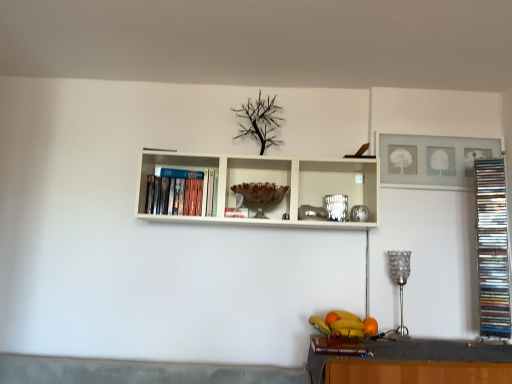
Question: Which direction should I rotate to look at matte brown book at lower center, positioned as the 1th book in front-to-back order, — up or down?

Choices:
 (A) up
 (B) down

Answer: (B)

Question: Is metallic silver stack of cds at right, placed as the third book when sorted from left to right, located outside orange matte at lower right?

Choices:
 (A) no
 (B) yes

Answer: (B)

Question: Can orange matte at lower right be found inside metallic silver stack of cds at right, arranged as the second book when viewed from the front?

Choices:
 (A) no
 (B) yes

Answer: (A)

Question: Considering the relative sizes of metallic silver stack of cds at right, which is the 1th book from right to left, and orange matte at lower right in the image provided, is metallic silver stack of cds at right, which is the 1th book from right to left, thinner than orange matte at lower right?

Choices:
 (A) no
 (B) yes

Answer: (A)

Question: From a real-world perspective, is metallic silver stack of cds at right, which is the 2th book in back-to-front order, located beneath orange matte at lower right?

Choices:
 (A) no
 (B) yes

Answer: (A)

Question: Does metallic silver stack of cds at right, arranged as the second book when viewed from the front, appear on the right side of orange matte at lower right?

Choices:
 (A) no
 (B) yes

Answer: (B)

Question: Does metallic silver stack of cds at right, arranged as the second book when viewed from the front, have a smaller size compared to orange matte at lower right?

Choices:
 (A) no
 (B) yes

Answer: (A)

Question: Does orange matte at lower right have a larger size compared to matte brown book at lower center, arranged as the 2th book when viewed from the left?

Choices:
 (A) yes
 (B) no

Answer: (B)

Question: Can you confirm if orange matte at lower right is wider than matte brown book at lower center, the third book when ordered from back to front?

Choices:
 (A) yes
 (B) no

Answer: (B)

Question: Is orange matte at lower right taller than matte brown book at lower center, the second book when ordered from right to left?

Choices:
 (A) yes
 (B) no

Answer: (A)

Question: Can you confirm if orange matte at lower right is thinner than matte brown book at lower center, arranged as the 2th book when viewed from the left?

Choices:
 (A) no
 (B) yes

Answer: (B)

Question: Is orange matte at lower right looking in the opposite direction of matte brown book at lower center, the second book when ordered from right to left?

Choices:
 (A) no
 (B) yes

Answer: (A)

Question: Is orange matte at lower right beside matte brown book at lower center, arranged as the 2th book when viewed from the left?

Choices:
 (A) yes
 (B) no

Answer: (B)

Question: Considering the relative sizes of matte plastic dvds at left, the 1th book positioned from the back, and orange matte at lower right in the image provided, is matte plastic dvds at left, the 1th book positioned from the back, shorter than orange matte at lower right?

Choices:
 (A) yes
 (B) no

Answer: (B)